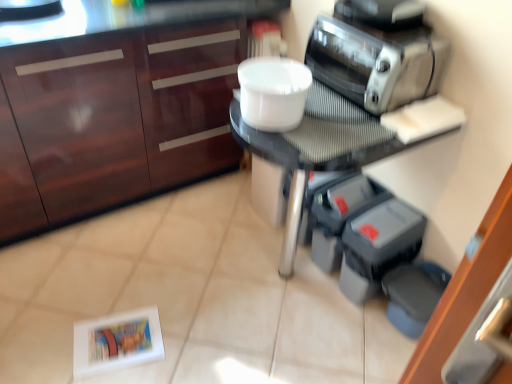
The width and height of the screenshot is (512, 384). I want to click on vacant space situated on the left part of matte black table at center, so click(x=176, y=266).